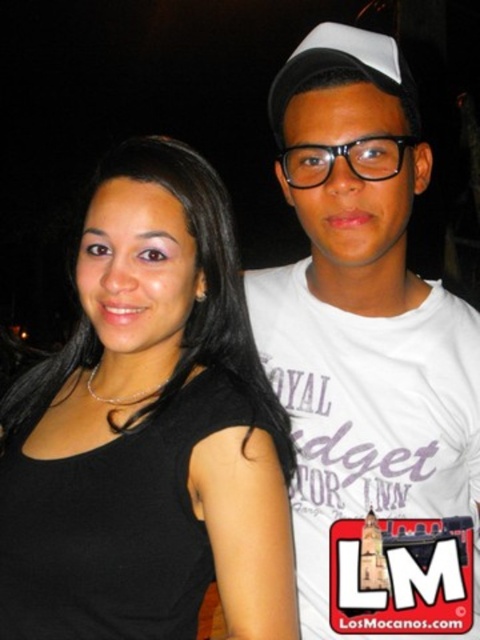
Question: Does white cotton t-shirt at upper right have a lesser width compared to black matte tank top at upper left?

Choices:
 (A) yes
 (B) no

Answer: (A)

Question: Can you confirm if black matte tank top at upper left is positioned below white matte baseball cap at upper center?

Choices:
 (A) yes
 (B) no

Answer: (A)

Question: Which object is positioned closest to the white matte baseball cap at upper center?

Choices:
 (A) black matte tank top at upper left
 (B) white cotton t-shirt at upper right

Answer: (B)

Question: Among these objects, which one is farthest from the camera?

Choices:
 (A) white cotton t-shirt at upper right
 (B) black matte tank top at upper left
 (C) white matte baseball cap at upper center

Answer: (C)

Question: Is white cotton t-shirt at upper right further to camera compared to black matte tank top at upper left?

Choices:
 (A) yes
 (B) no

Answer: (A)

Question: Estimate the real-world distances between objects in this image. Which object is closer to the white matte baseball cap at upper center?

Choices:
 (A) black matte tank top at upper left
 (B) white cotton t-shirt at upper right

Answer: (B)